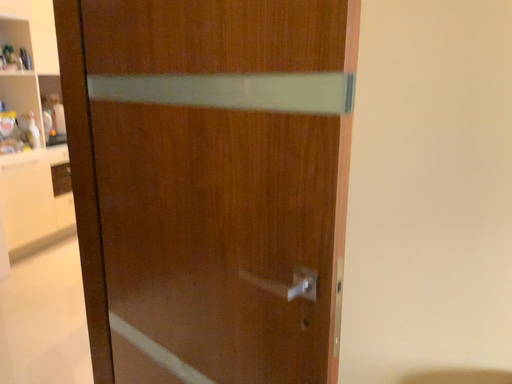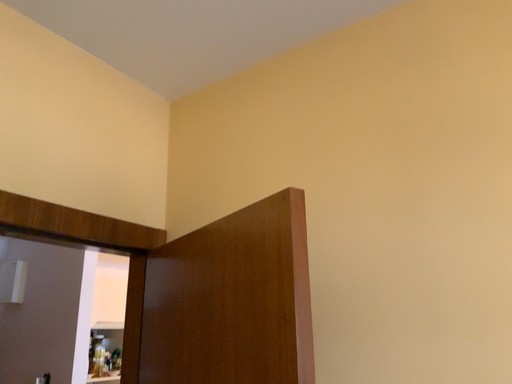
Question: How did the camera likely rotate when shooting the video?

Choices:
 (A) rotated downward
 (B) rotated upward

Answer: (B)